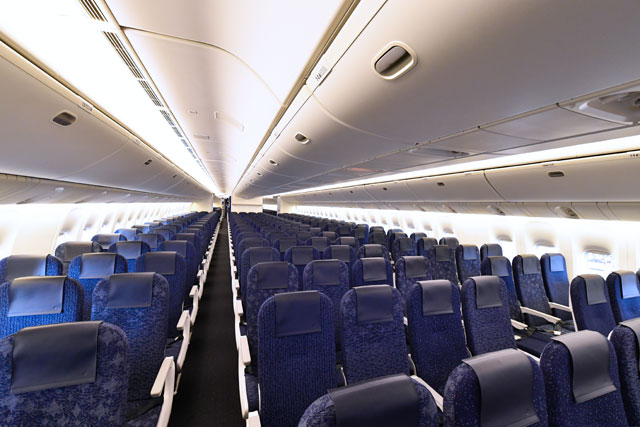
The image size is (640, 427). I want to click on vent, so click(77, 8), click(118, 62), click(147, 97), click(168, 131), click(176, 142), click(192, 155), click(198, 167), click(207, 180).